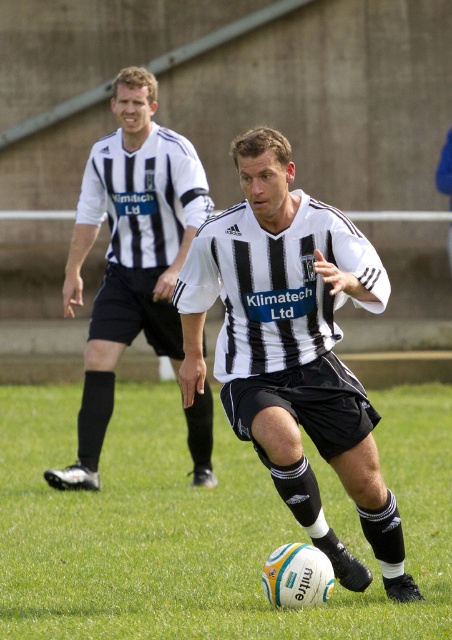
Does black matte soccer ball at center appear over black and white striped shirt at left?

No, black matte soccer ball at center is not above black and white striped shirt at left.

Does point (226, 323) lie behind point (188, 209)?

No, (226, 323) is closer to viewer.

Does point (180, 310) come in front of point (188, 180)?

That is True.

Locate an element on the screen. black matte soccer ball at center is located at coordinates (292, 348).

Between white textured football at center and black and white striped shirt at left, which one has less height?

white textured football at center

Which is more to the left, white textured football at center or black and white striped shirt at left?

black and white striped shirt at left

Is point (436, 388) positioned before point (160, 285)?

No, it is not.

Find the location of a particular element. white textured football at center is located at coordinates pos(202,525).

Which is more to the right, white textured football at center or black matte soccer ball at center?

Positioned to the right is white textured football at center.

Where is `white textured football at center`? Image resolution: width=452 pixels, height=640 pixels. white textured football at center is located at coordinates (202, 525).